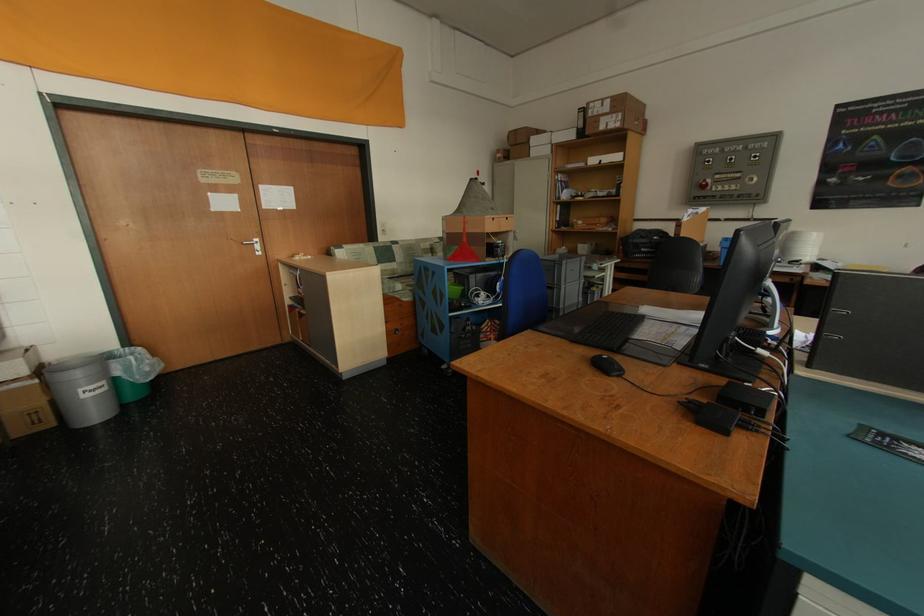
The image size is (924, 616). Describe the element at coordinates (131, 371) in the screenshot. I see `the green trash bin` at that location.